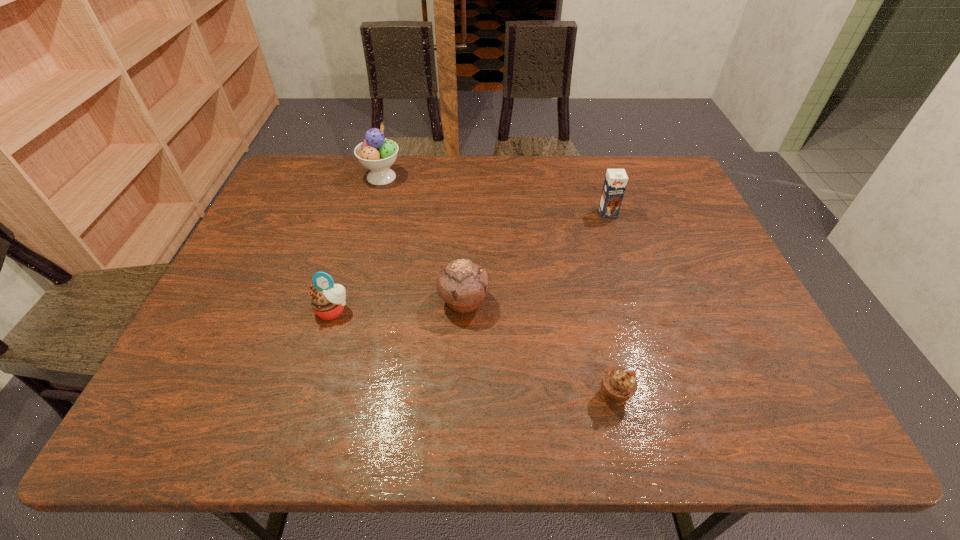
The image size is (960, 540). I want to click on icecream, so click(376, 153).

Identify the location of the rightmost object. (615, 182).

The image size is (960, 540). I want to click on the fourth nearest object, so click(615, 182).

Identify the location of the third object from right to left. tap(462, 284).

In order to click on the leftmost muffin in this screenshot , I will do `click(328, 300)`.

At what (x,y) coordinates should I click in order to perform the action: click on the fourth object from left to right. Please return your answer as a coordinate pair (x, y). The height and width of the screenshot is (540, 960). Looking at the image, I should click on (618, 384).

Where is `the rightmost muffin`? The image size is (960, 540). the rightmost muffin is located at coordinates (618, 384).

The height and width of the screenshot is (540, 960). I want to click on free space located on the right of the farthest object, so click(x=496, y=177).

The image size is (960, 540). What are the coordinates of `vacant space positioned on the front label of the fourth shortest object` in the screenshot? It's located at (632, 287).

Locate an element on the screen. The height and width of the screenshot is (540, 960). free region located on the left of the second muffin from right to left is located at coordinates (364, 301).